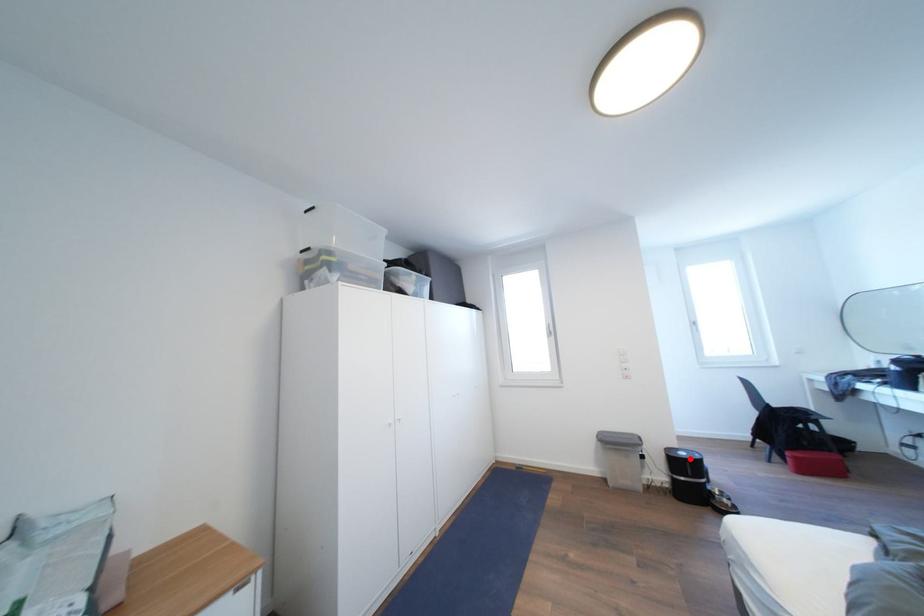
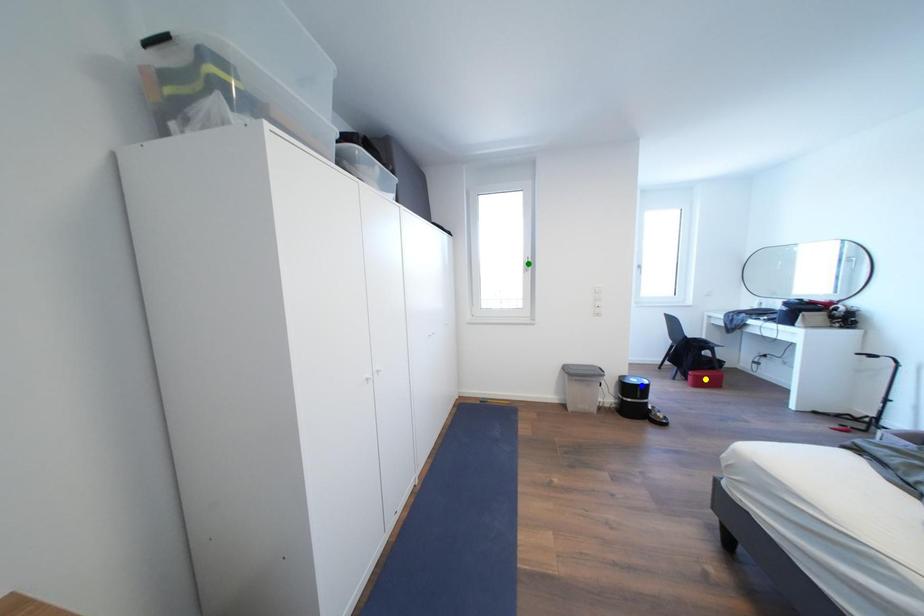
Question: I am providing you with two images of the same scene from different viewpoints. A red point is marked on the first image. You are given multiple points on the second image. Which point in image 2 is actually the same real-world point as the red point in image 1?

Choices:
 (A) green point
 (B) yellow point
 (C) blue point

Answer: (C)